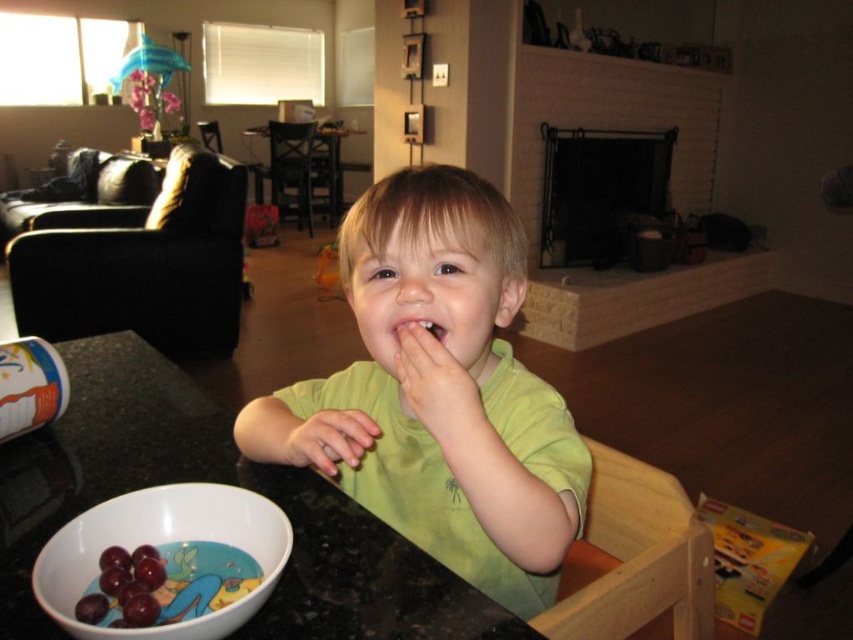
You are standing in the kitchen area of the image. There are two points marked in the scene. One is at coordinate point (514,506) and the other is at coordinate point (103,572). If you want to move from the point closer to you to the one further away, which point should you start from?

You should start from point (103,572) because point (514,506) is behind point (103,572), meaning point (103,572) is closer to you and point (514,506) is further away.

You are a parent trying to ensure your child eats healthy snacks. You see the shiny purple grapes at lower left and the smooth skin at mouth right. Which item is closer to the child?

The shiny purple grapes at lower left are closer to the child since they are positioned in front of the smooth skin at mouth right.